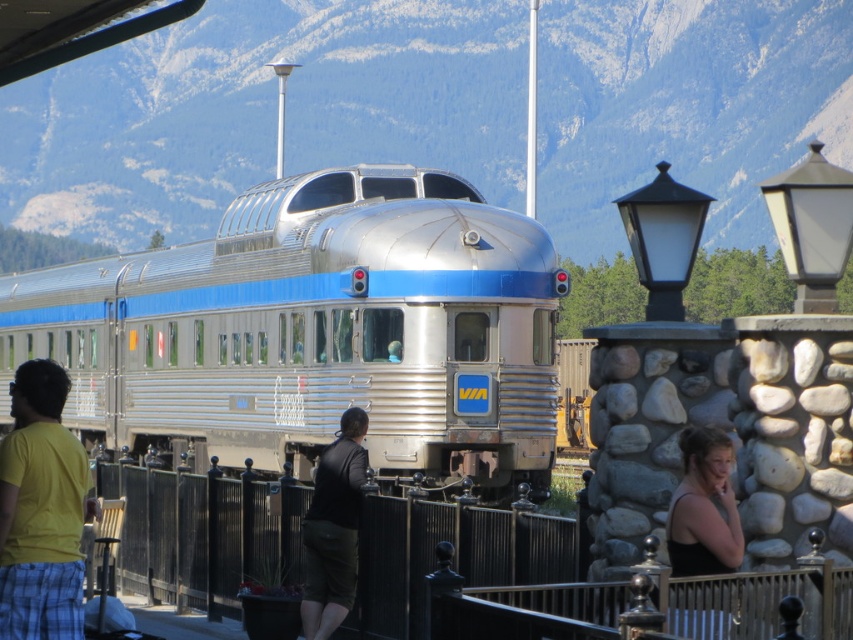
Question: Does silver/aluminum train at center come in front of yellow t-shirt at left?

Choices:
 (A) yes
 (B) no

Answer: (B)

Question: Which point appears closest to the camera in this image?

Choices:
 (A) (734, 522)
 (B) (42, 618)
 (C) (212, 301)
 (D) (350, 458)

Answer: (A)

Question: In this image, where is yellow t-shirt at left located relative to black tank top at lower right?

Choices:
 (A) above
 (B) below

Answer: (B)

Question: From the image, what is the correct spatial relationship of yellow t-shirt at left in relation to black tank top at lower right?

Choices:
 (A) above
 (B) below

Answer: (B)

Question: Which object appears farthest from the camera in this image?

Choices:
 (A) yellow t-shirt at left
 (B) black tank top at lower right

Answer: (A)

Question: Which object is the closest to the silver/aluminum train at center?

Choices:
 (A) dark green shorts at center
 (B) black tank top at lower right

Answer: (A)